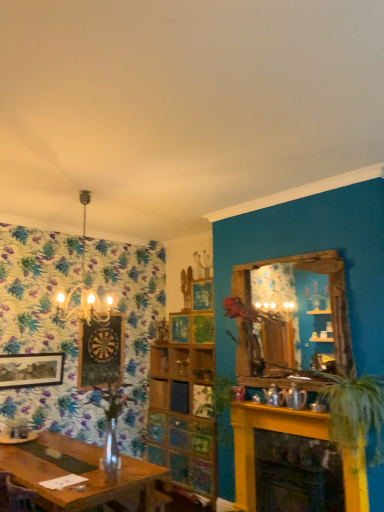
Question: From a real-world perspective, is wooden dartboard at left, which is the first picture frame in right-to-left order, on top of green leafy plant at center, which ranks as the second plant in right-to-left order?

Choices:
 (A) yes
 (B) no

Answer: (A)

Question: Does wooden dartboard at left, which is the 2th picture frame from left to right, have a greater width compared to green leafy plant at center, arranged as the third plant when viewed from the front?

Choices:
 (A) no
 (B) yes

Answer: (A)

Question: Is wooden dartboard at left, which is the first picture frame in right-to-left order, oriented towards green leafy plant at center, arranged as the third plant when viewed from the front?

Choices:
 (A) yes
 (B) no

Answer: (A)

Question: Can we say wooden dartboard at left, which ranks as the 2th picture frame in front-to-back order, lies outside green leafy plant at center, the 1th plant from the back?

Choices:
 (A) no
 (B) yes

Answer: (B)

Question: From a real-world perspective, is wooden dartboard at left, arranged as the 1th picture frame when viewed from the back, beneath green leafy plant at center, arranged as the third plant when viewed from the front?

Choices:
 (A) yes
 (B) no

Answer: (B)

Question: Considering the positions of wooden mirror at upper right and gold metallic chandelier at upper left in the image, is wooden mirror at upper right taller or shorter than gold metallic chandelier at upper left?

Choices:
 (A) short
 (B) tall

Answer: (A)

Question: Is point (246, 381) closer or farther from the camera than point (92, 293)?

Choices:
 (A) farther
 (B) closer

Answer: (A)

Question: From a real-world perspective, is wooden mirror at upper right above or below gold metallic chandelier at upper left?

Choices:
 (A) above
 (B) below

Answer: (B)

Question: Which is correct: wooden mirror at upper right is inside gold metallic chandelier at upper left, or outside of it?

Choices:
 (A) inside
 (B) outside

Answer: (B)

Question: Considering their positions, is yellow painted brick fireplace at lower right located in front of or behind wooden mirror at upper right?

Choices:
 (A) behind
 (B) front

Answer: (B)

Question: In terms of height, does yellow painted brick fireplace at lower right look taller or shorter compared to wooden mirror at upper right?

Choices:
 (A) tall
 (B) short

Answer: (B)

Question: Does point (304, 435) appear closer or farther from the camera than point (249, 333)?

Choices:
 (A) closer
 (B) farther

Answer: (A)

Question: From the image's perspective, is yellow painted brick fireplace at lower right above or below wooden mirror at upper right?

Choices:
 (A) below
 (B) above

Answer: (A)

Question: Considering the positions of point (49, 371) and point (317, 425), is point (49, 371) closer or farther from the camera than point (317, 425)?

Choices:
 (A) farther
 (B) closer

Answer: (A)

Question: Is matte black picture frame at left, the second picture frame in the right-to-left sequence, bigger or smaller than yellow painted brick fireplace at lower right?

Choices:
 (A) big
 (B) small

Answer: (B)